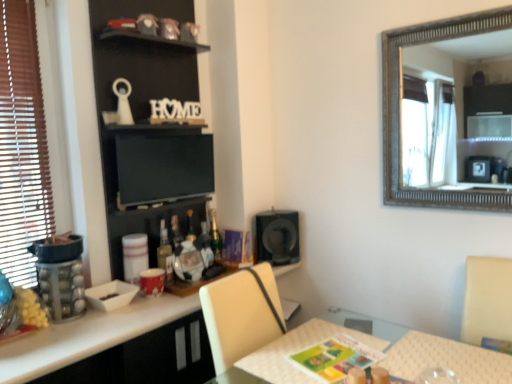
Question: Is black matte speaker at center positioned with its back to matte glass bottle at center, the second bottle in the right-to-left sequence?

Choices:
 (A) yes
 (B) no

Answer: (B)

Question: Is black matte speaker at center aimed at matte glass bottle at center, the second bottle viewed from the back?

Choices:
 (A) yes
 (B) no

Answer: (B)

Question: From the image's perspective, is black matte speaker at center below matte glass bottle at center, the second bottle viewed from the back?

Choices:
 (A) no
 (B) yes

Answer: (A)

Question: Is the depth of black matte speaker at center greater than that of matte glass bottle at center, the first bottle in the left-to-right sequence?

Choices:
 (A) no
 (B) yes

Answer: (B)

Question: Does black matte speaker at center have a lesser height compared to matte glass bottle at center, the second bottle in the right-to-left sequence?

Choices:
 (A) yes
 (B) no

Answer: (B)

Question: From a real-world perspective, is black matte speaker at center below matte glass bottle at center, the first bottle in the left-to-right sequence?

Choices:
 (A) yes
 (B) no

Answer: (B)

Question: Could matte glass bottle at center, the 1th bottle when ordered from front to back, be considered to be inside green glass bottle at center, which is counted as the first bottle, starting from the right?

Choices:
 (A) yes
 (B) no

Answer: (B)

Question: Does green glass bottle at center, positioned as the second bottle in left-to-right order, have a lesser width compared to matte glass bottle at center, the second bottle in the right-to-left sequence?

Choices:
 (A) yes
 (B) no

Answer: (A)

Question: From a real-world perspective, is green glass bottle at center, which is counted as the first bottle, starting from the right, located higher than matte glass bottle at center, the first bottle in the left-to-right sequence?

Choices:
 (A) yes
 (B) no

Answer: (A)

Question: Is the depth of green glass bottle at center, which is counted as the first bottle, starting from the right, greater than that of matte glass bottle at center, the 1th bottle when ordered from front to back?

Choices:
 (A) no
 (B) yes

Answer: (B)

Question: Is green glass bottle at center, the 2th bottle viewed from the front, at the left side of matte glass bottle at center, the second bottle in the right-to-left sequence?

Choices:
 (A) no
 (B) yes

Answer: (A)

Question: Is green glass bottle at center, the 2th bottle viewed from the front, outside of matte glass bottle at center, the second bottle in the right-to-left sequence?

Choices:
 (A) yes
 (B) no

Answer: (A)

Question: Does black matte bookshelf at upper left have a greater height compared to green glass bottle at center, positioned as the second bottle in left-to-right order?

Choices:
 (A) yes
 (B) no

Answer: (A)